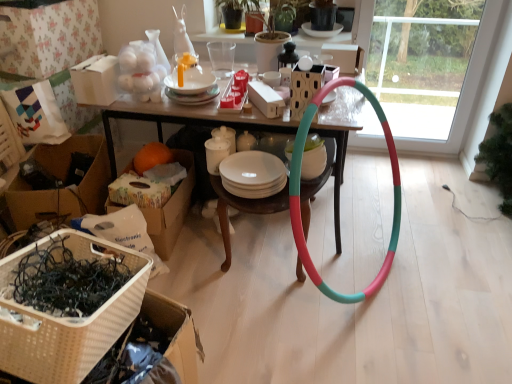
Where is `free spot to the right of wooden table at center`? The image size is (512, 384). free spot to the right of wooden table at center is located at coordinates (429, 229).